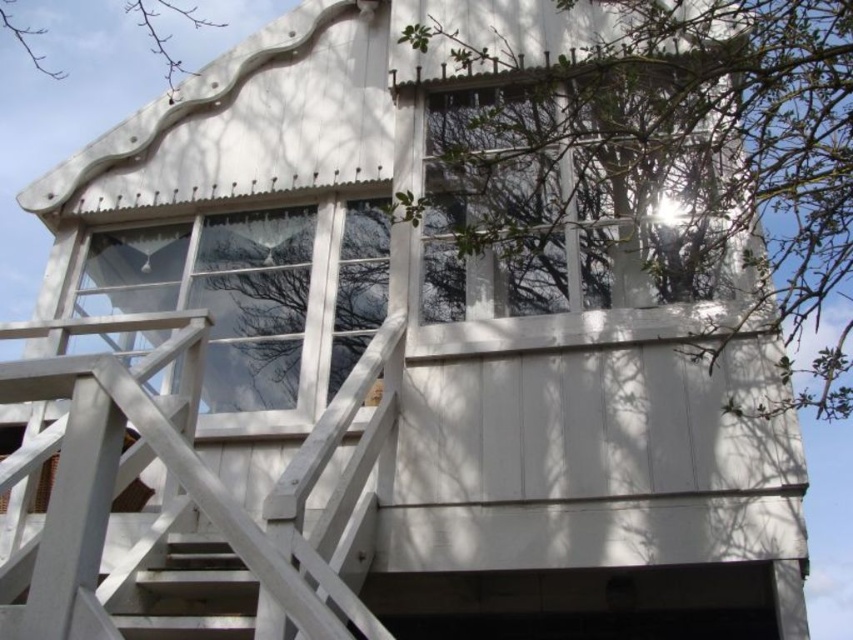
Question: Which point appears closest to the camera in this image?

Choices:
 (A) (572, 193)
 (B) (260, 349)
 (C) (21, 45)

Answer: (A)

Question: Among these points, which one is farthest from the camera?

Choices:
 (A) (300, 380)
 (B) (281, 552)
 (C) (759, 22)

Answer: (A)

Question: Which point appears farthest from the camera in this image?

Choices:
 (A) (91, 513)
 (B) (778, 310)
 (C) (279, 310)
 (D) (22, 32)

Answer: (D)

Question: Considering the relative positions of green leafy tree at upper right and white wooden staircase at center in the image provided, where is green leafy tree at upper right located with respect to white wooden staircase at center?

Choices:
 (A) left
 (B) right

Answer: (B)

Question: Can you confirm if green leafy tree at upper right is positioned to the right of bare branches at upper left?

Choices:
 (A) no
 (B) yes

Answer: (B)

Question: Does green leafy tree at upper right appear on the left side of clear glass window at center?

Choices:
 (A) no
 (B) yes

Answer: (A)